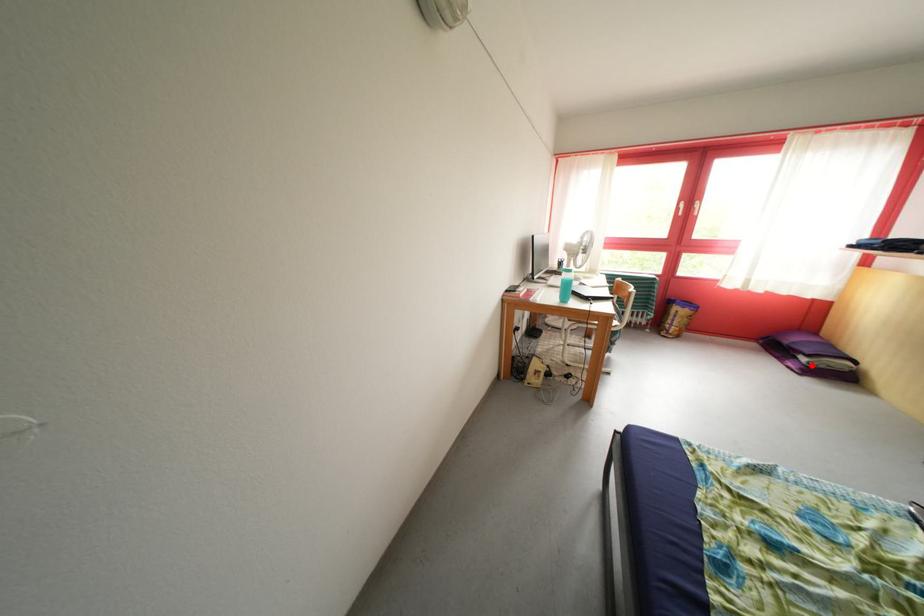
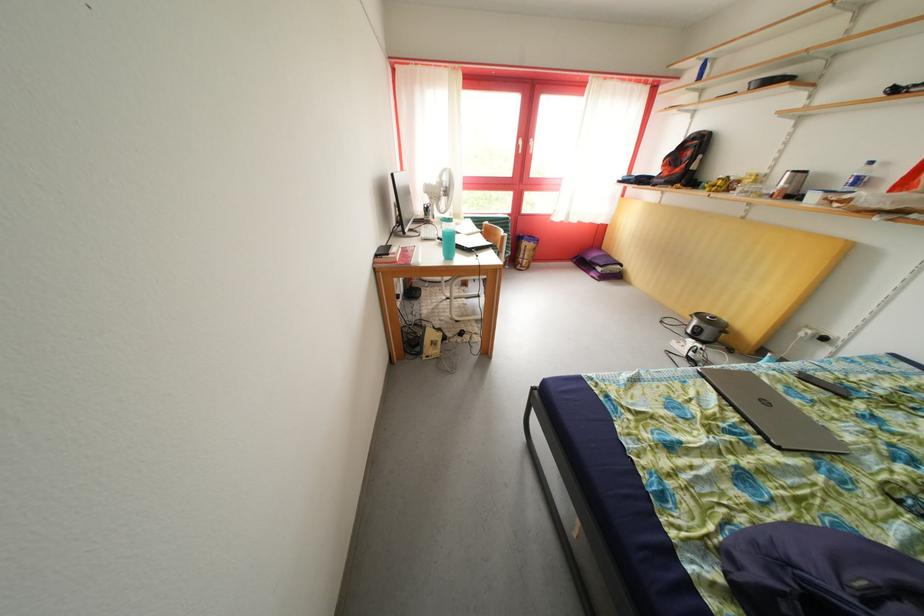
Where in the second image is the point corresponding to the highlighted location from the first image?

(608, 275)